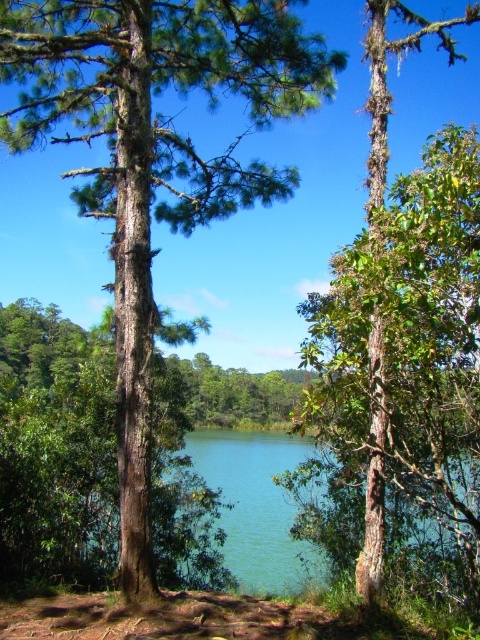
Consider the image. You are a hiker standing in the middle of the forest and see both the brown rough tree at center and the green rough bark tree at center. Which tree is closer to you?

The brown rough tree at center is closer to you since it is further to the viewer than the green rough bark tree at center.

You are standing in a forest and see the brown rough tree at center and the green rough bark tree at center. Which tree is positioned higher in the image?

The brown rough tree at center is positioned higher than the green rough bark tree at center.

Looking at this image, you are a hiker who wants to determine which tree is shorter between the brown rough tree at center and the green rough bark tree at center. Based on the scene, which tree is shorter?

The brown rough tree at center is shorter than the green rough bark tree at center according to the description.